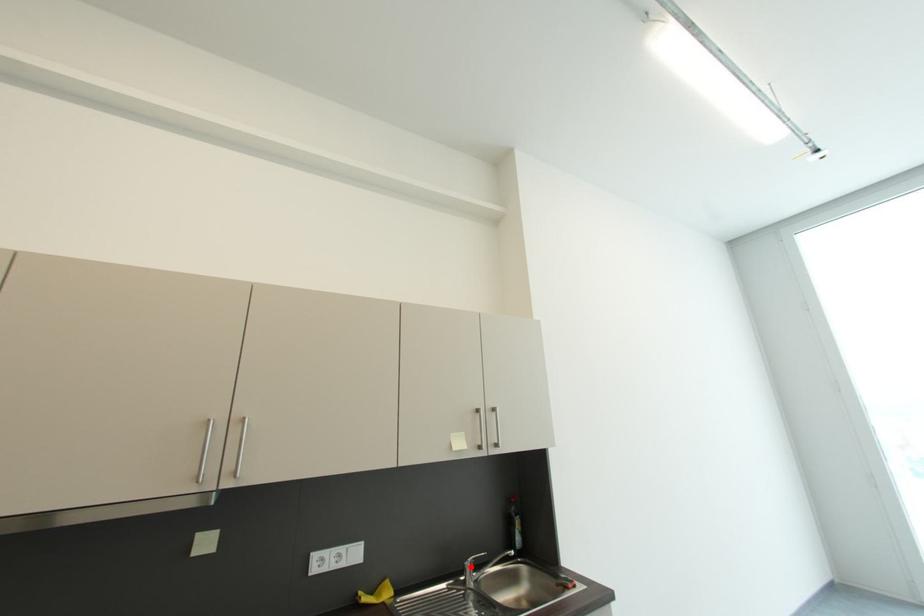
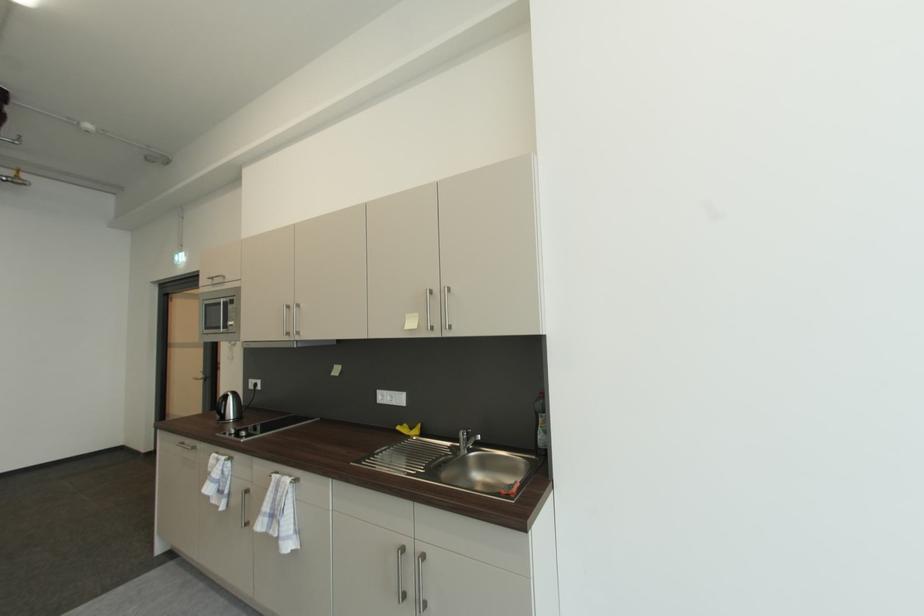
Find the pixel in the second image that matches the highlighted location in the first image.

(465, 435)